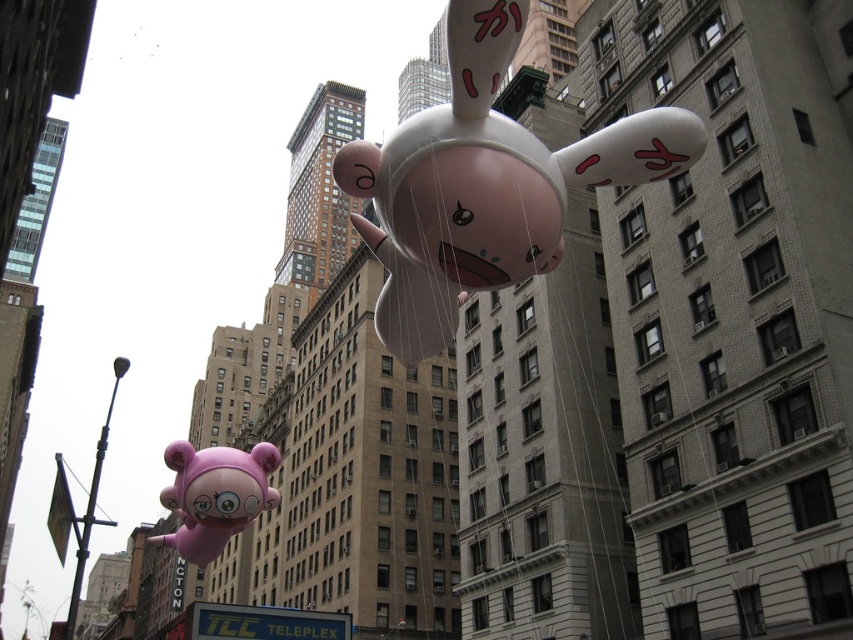
The height and width of the screenshot is (640, 853). What are the coordinates of `pink rubber balloon at center` in the screenshot? It's located at (485, 184).

Does pink rubber balloon at center appear over matte pink balloon at lower left?

Indeed, pink rubber balloon at center is positioned over matte pink balloon at lower left.

Between point (585, 164) and point (250, 484), which one is positioned behind?

Point (250, 484)

Where is `pink rubber balloon at center`? This screenshot has width=853, height=640. pink rubber balloon at center is located at coordinates (485, 184).